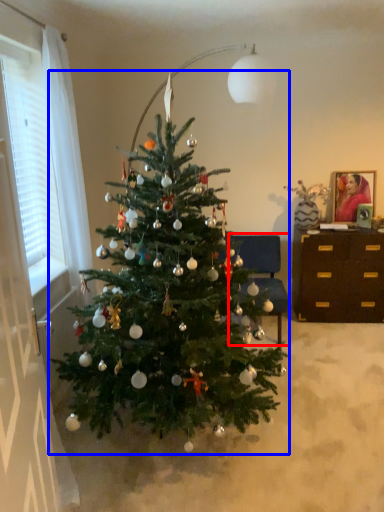
Question: Which of the following is the farthest to the observer, armchair (highlighted by a red box) or christmas tree (highlighted by a blue box)?

Choices:
 (A) armchair
 (B) christmas tree

Answer: (A)